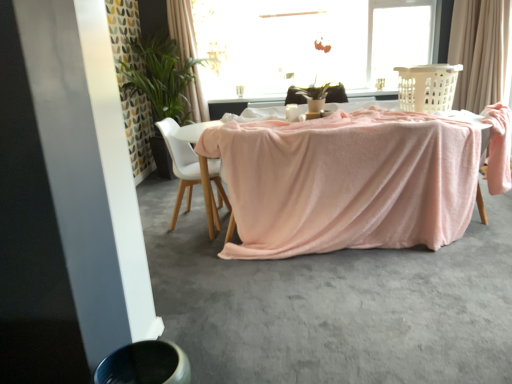
Question: Considering the relative sizes of white matte chair at center and smooth gray concrete at lower center in the image provided, is white matte chair at center taller than smooth gray concrete at lower center?

Choices:
 (A) no
 (B) yes

Answer: (B)

Question: Is smooth gray concrete at lower center at the back of white matte chair at center?

Choices:
 (A) yes
 (B) no

Answer: (B)

Question: Is the position of white matte chair at center less distant than that of smooth gray concrete at lower center?

Choices:
 (A) no
 (B) yes

Answer: (A)

Question: Is white matte chair at center directly adjacent to smooth gray concrete at lower center?

Choices:
 (A) no
 (B) yes

Answer: (A)

Question: Does white matte chair at center have a lesser width compared to smooth gray concrete at lower center?

Choices:
 (A) no
 (B) yes

Answer: (B)

Question: From a real-world perspective, is white matte chair at center on top of smooth gray concrete at lower center?

Choices:
 (A) no
 (B) yes

Answer: (B)

Question: Is white matte chair at center not near transparent glass window at upper center?

Choices:
 (A) no
 (B) yes

Answer: (B)

Question: From the image's perspective, is white matte chair at center over transparent glass window at upper center?

Choices:
 (A) yes
 (B) no

Answer: (B)

Question: Considering the relative sizes of white matte chair at center and transparent glass window at upper center in the image provided, is white matte chair at center smaller than transparent glass window at upper center?

Choices:
 (A) yes
 (B) no

Answer: (A)

Question: Is white matte chair at center further to the viewer compared to transparent glass window at upper center?

Choices:
 (A) no
 (B) yes

Answer: (A)

Question: Considering the relative sizes of white matte chair at center and transparent glass window at upper center in the image provided, is white matte chair at center bigger than transparent glass window at upper center?

Choices:
 (A) no
 (B) yes

Answer: (A)

Question: Is white matte chair at center to the left of transparent glass window at upper center from the viewer's perspective?

Choices:
 (A) yes
 (B) no

Answer: (A)